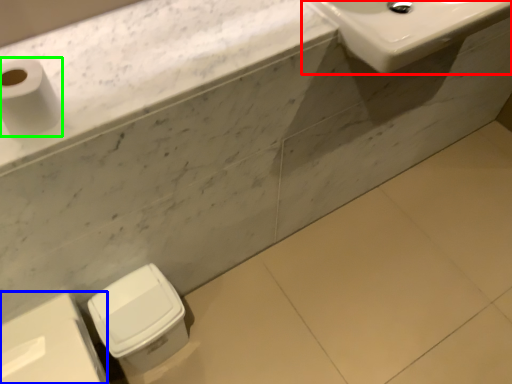
Question: Estimate the real-world distances between objects in this image. Which object is closer to sink (highlighted by a red box), porcelain (highlighted by a blue box) or toilet paper (highlighted by a green box)?

Choices:
 (A) porcelain
 (B) toilet paper

Answer: (B)